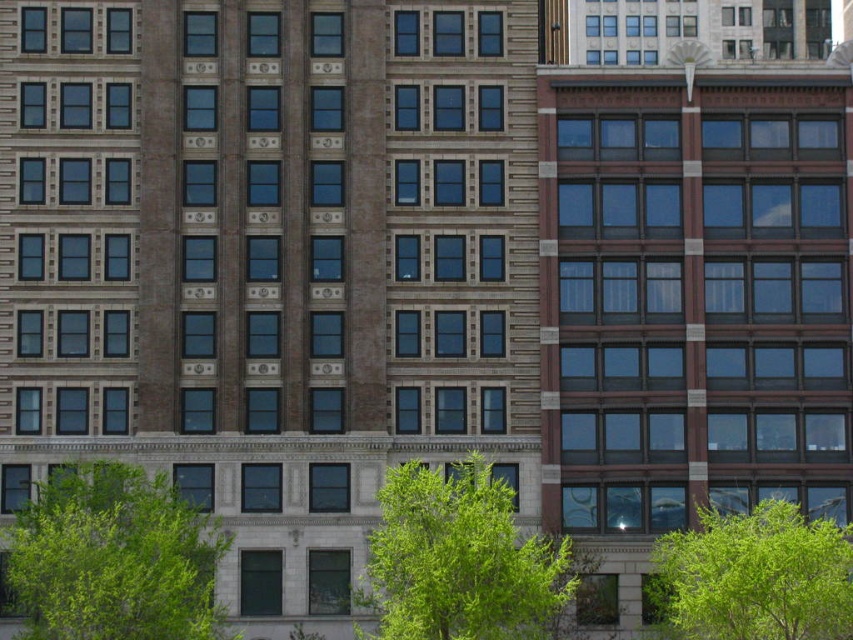
You are a landscape architect designing a garden around the multi story building. You have two green leafy trees to place. The green leafy tree at lower center and the green leafy tree at lower right. Which tree should you choose if you want to create a focal point with a larger tree?

The green leafy tree at lower center is larger in size than the green leafy tree at lower right, so you should choose the green leafy tree at lower center to create a focal point with a larger tree.

Consider the image. You are standing in front of the building and see two points marked on the facade. The first point is at coordinates point (45, 516) and the second is at point (459, 468). Which point is closer to you?

Point (45, 516) is in front of point (459, 468), so it is closer to you.